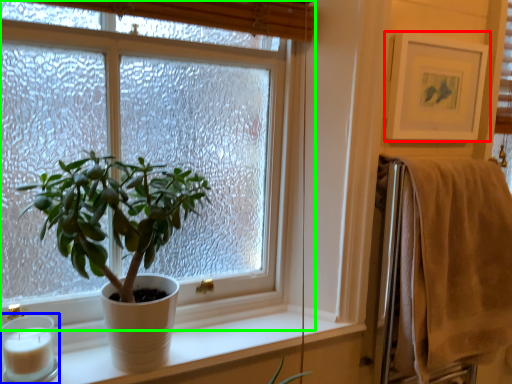
Question: Which object is positioned closest to picture frame (highlighted by a red box)? Select from candle holder (highlighted by a blue box) and window (highlighted by a green box).

Choices:
 (A) candle holder
 (B) window

Answer: (B)